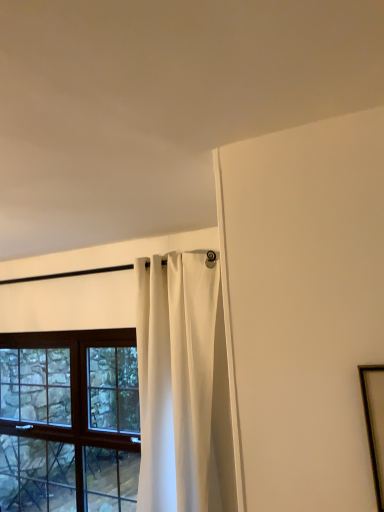
Question: Considering the positions of white matte curtain at upper center and wooden picture frame at right in the image, is white matte curtain at upper center wider or thinner than wooden picture frame at right?

Choices:
 (A) wide
 (B) thin

Answer: (A)

Question: Choose the correct answer: Is white matte curtain at upper center inside wooden picture frame at right or outside it?

Choices:
 (A) outside
 (B) inside

Answer: (A)

Question: Based on their relative distances, which object is farther from the wooden-framed window at left?

Choices:
 (A) wooden picture frame at right
 (B) white matte curtain at upper center

Answer: (A)

Question: Which is nearer to the wooden-framed window at left?

Choices:
 (A) white matte curtain at upper center
 (B) wooden picture frame at right

Answer: (A)